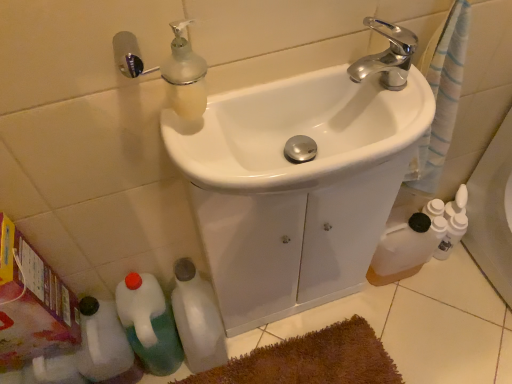
This screenshot has width=512, height=384. I want to click on vacant area that lies to the right of brown plush bath mat at lower center, so click(430, 324).